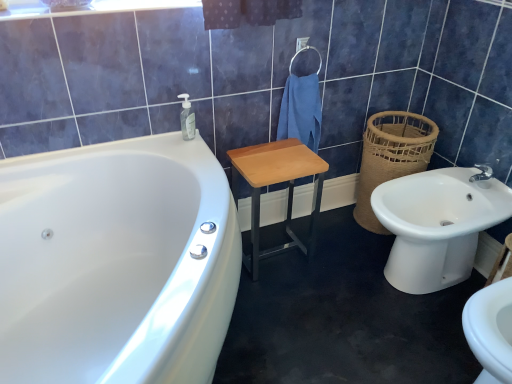
Identify the location of vacant region to the left of brown woven basket at right. The image size is (512, 384). (334, 228).